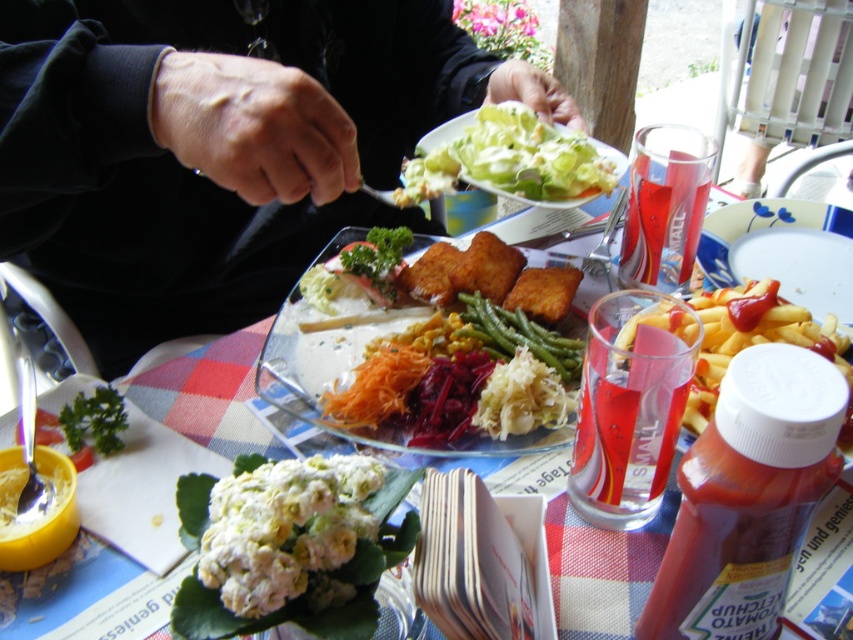
Question: Which of the following is the farthest from the observer?

Choices:
 (A) golden crispy fish at center
 (B) white creamy salad at upper center
 (C) white fluffy salad at center

Answer: (B)

Question: Which object is the farthest from the yellowish matte french fries at right?

Choices:
 (A) matte black jacket at upper left
 (B) golden crispy fish at center
 (C) green smoothish/texturedish green beans at center

Answer: (A)

Question: Is yellowish matte french fries at right closer to the viewer compared to green smoothish/texturedish green beans at center?

Choices:
 (A) yes
 (B) no

Answer: (A)

Question: Which of the following is the farthest from the observer?

Choices:
 (A) yellowish matte french fries at right
 (B) white creamy salad at upper center
 (C) green smoothish/texturedish green beans at center

Answer: (B)

Question: Can you confirm if golden crispy fish at center is positioned above yellowish matte french fries at right?

Choices:
 (A) yes
 (B) no

Answer: (A)

Question: Can you confirm if white creamy salad at upper center is thinner than green smoothish/texturedish green beans at center?

Choices:
 (A) yes
 (B) no

Answer: (B)